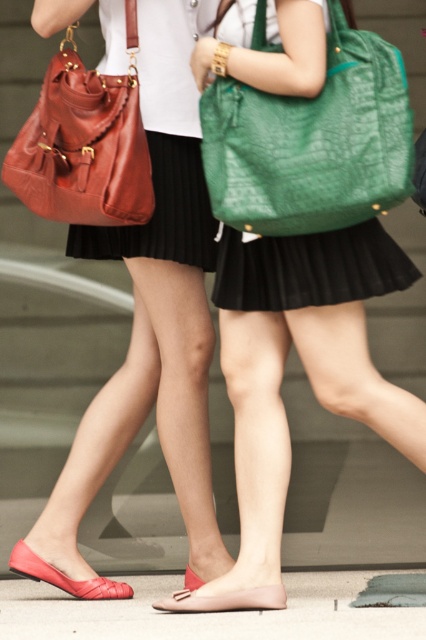
Question: Observing the image, what is the correct spatial positioning of matte green leather bag at center in reference to green textured tote at upper center?

Choices:
 (A) right
 (B) left

Answer: (A)

Question: Estimate the real-world distances between objects in this image. Which object is closer to the matte green leather bag at center?

Choices:
 (A) green textured tote at upper center
 (B) matte leather shoulder bag at left
 (C) matte red sandal at lower left
 (D) smooth concrete pavement at lower center

Answer: (A)

Question: Which of these objects is positioned farthest from the matte red sandal at lower left?

Choices:
 (A) smooth concrete pavement at lower center
 (B) matte green leather bag at center
 (C) green textured tote at upper center
 (D) matte pink leather sandal at lower center

Answer: (C)

Question: Does matte green leather bag at center appear on the left side of matte red sandal at lower left?

Choices:
 (A) yes
 (B) no

Answer: (B)

Question: Can you confirm if smooth concrete pavement at lower center is positioned above matte leather shoulder bag at left?

Choices:
 (A) no
 (B) yes

Answer: (A)

Question: Which point is farther from the camera taking this photo?

Choices:
 (A) (270, 374)
 (B) (16, 605)

Answer: (B)